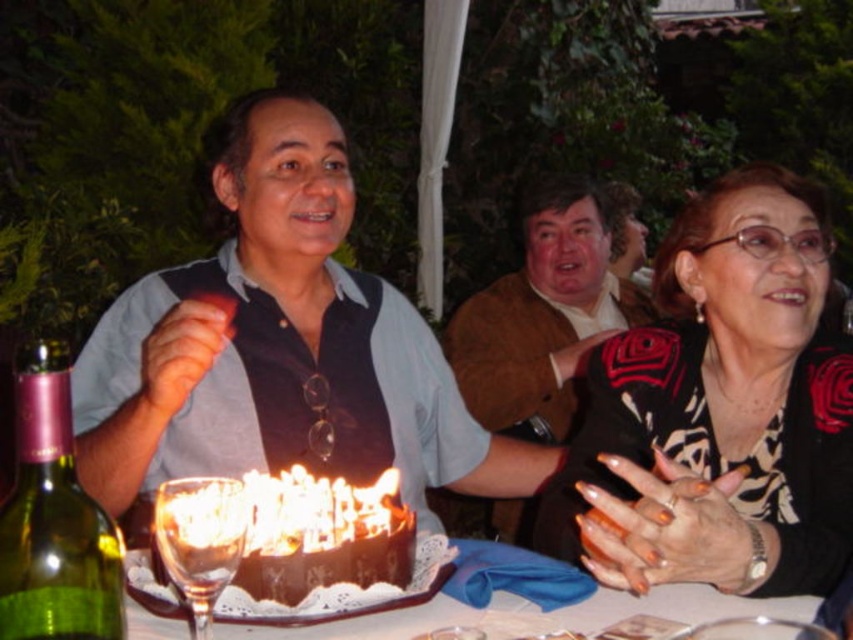
You are a guest at this birthday party and notice the matte brown vest at center and the white lace doily at center on the table. Which item is placed directly on top of the other?

The matte brown vest at center is positioned over the white lace doily at center, meaning the vest is directly on top of the doily.

From the picture: You are a photographer at a birthday party. You want to take a photo of the matte brown vest at center. The camera you are using has a minimum focusing distance of 36 inches. Can you take the photo without moving either the camera or the vest?

The distance between the matte brown vest at center and the camera is 35.55 inches, which is less than the camera minimum focusing distance of 36 inches. Therefore, you cannot take the photo without moving either the camera or the vest.

You are a guest at this party and want to know if the matte brown vest at center could cover the brown fuzzy sweater at upper center if placed over it. Based on their sizes, is this possible?

The matte brown vest at center might be wider than brown fuzzy sweater at upper center, so it is possible that the matte brown vest at center could cover the brown fuzzy sweater at upper center when placed over it.